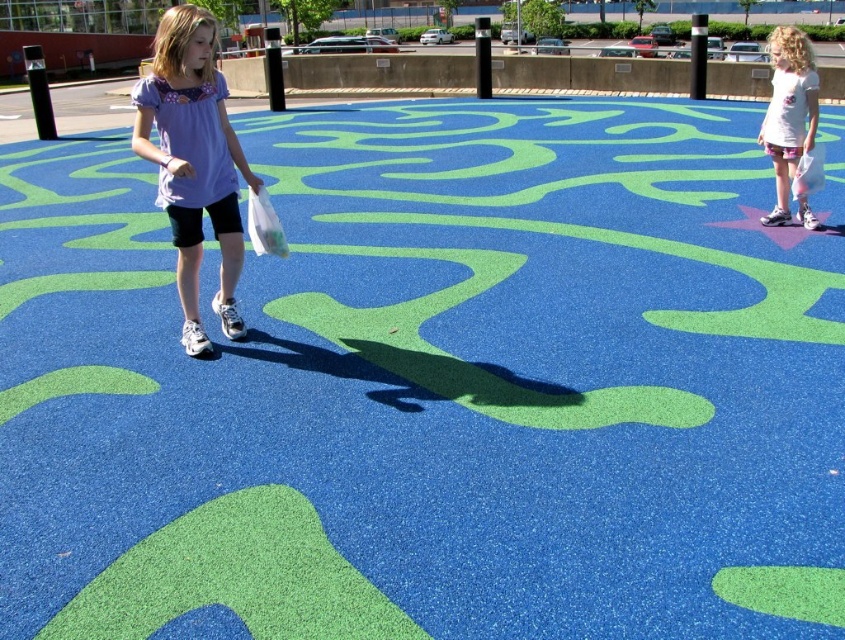
You are a photographer standing at the center of the playground. You want to take a photo of the matte purple shirt at center. Where should you point your camera to capture it?

You should point your camera towards the coordinates point at point (194, 161) to capture the matte purple shirt at center.